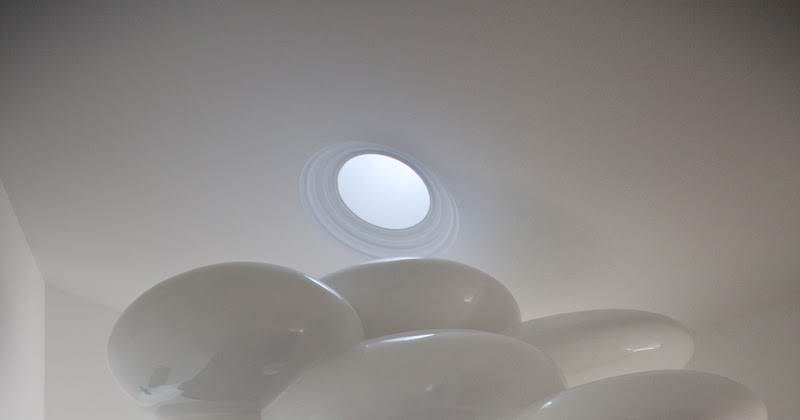
Locate an element on the screen. The height and width of the screenshot is (420, 800). ceiling is located at coordinates (561, 176).